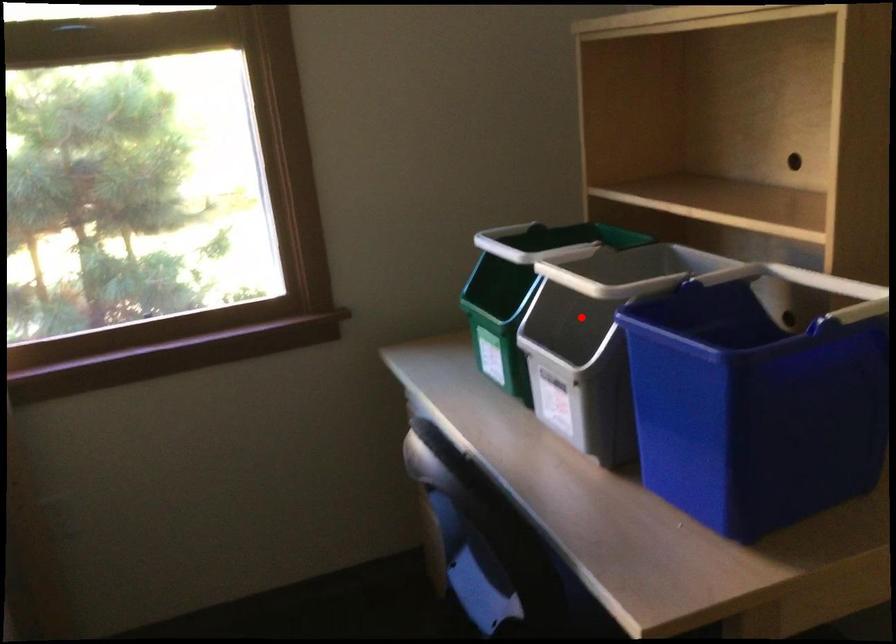
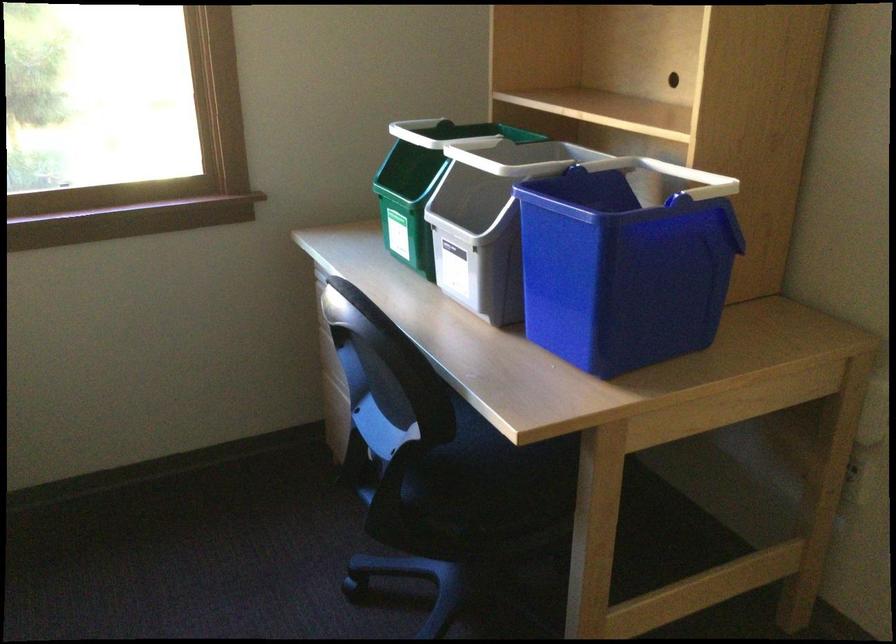
Locate, in the second image, the point that corresponds to the highlighted location in the first image.

(479, 201)